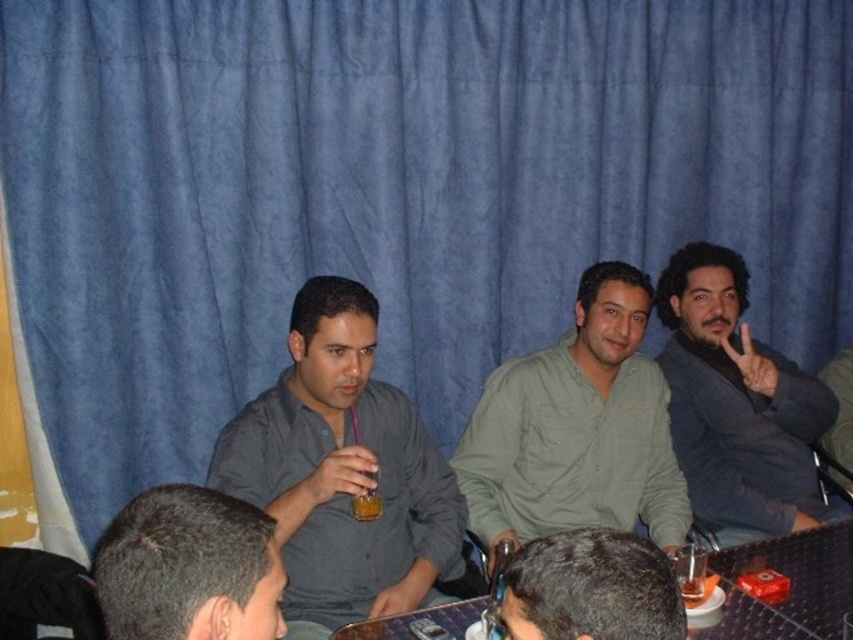
Question: Which point is closer to the camera?

Choices:
 (A) dark brown hair at lower center
 (B) matte gray shirt at center
 (C) dark brown wooden table at center
 (D) translucent glass at center

Answer: (A)

Question: Which of the following is the farthest from the observer?

Choices:
 (A) (833, 628)
 (B) (723, 289)
 (C) (221, 525)

Answer: (B)

Question: Can you confirm if dark blue suit at right is wider than dark brown wooden table at center?

Choices:
 (A) yes
 (B) no

Answer: (B)

Question: Which point appears closest to the camera in this image?

Choices:
 (A) (302, 468)
 (B) (229, 531)
 (C) (761, 616)

Answer: (B)

Question: Can you confirm if dark brown hair at lower center is positioned above translucent glass cup at center?

Choices:
 (A) no
 (B) yes

Answer: (B)

Question: Is translucent glass at center positioned at the back of translucent glass cup at center?

Choices:
 (A) yes
 (B) no

Answer: (A)